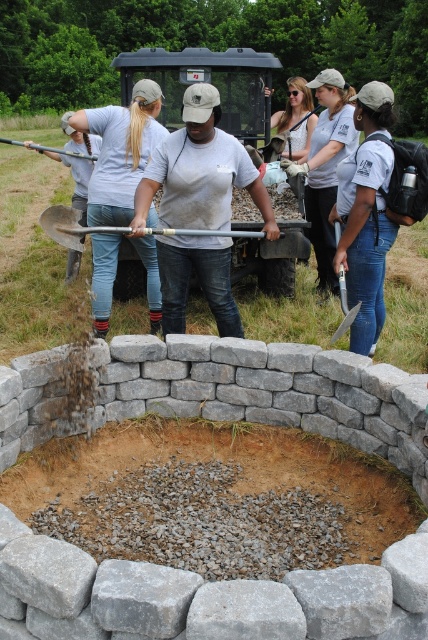
You are a photographer standing at the edge of the construction area. You want to take a photo that includes both the white cotton shirt at center and the white lace dress at center. What is the minimum distance you need to move backward to ensure both are fully visible in your frame?

The white cotton shirt at center and white lace dress at center are 5.12 feet apart. To capture both in your frame, you need to move back at least 5.12 feet to ensure the entire distance between them fits within the camera view.